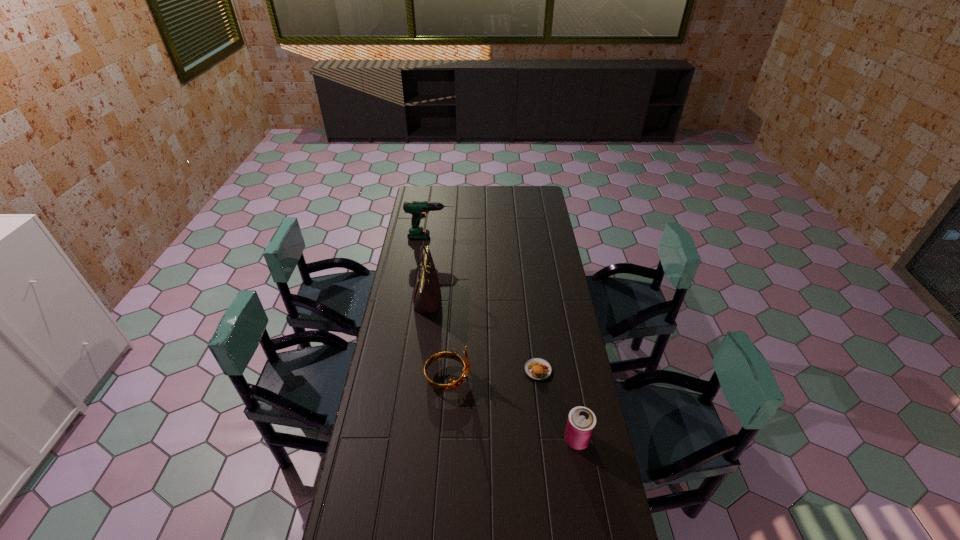
This screenshot has height=540, width=960. Find the location of `handbag`. handbag is located at coordinates (426, 295).

Identify the location of the second farthest object. Image resolution: width=960 pixels, height=540 pixels. (426, 295).

Locate an element on the screen. the farthest object is located at coordinates (418, 209).

Locate an element on the screen. the fourth shortest object is located at coordinates (418, 209).

The height and width of the screenshot is (540, 960). I want to click on the third tallest object, so click(452, 355).

Where is `the rightmost object`? The image size is (960, 540). the rightmost object is located at coordinates (581, 422).

Locate an element on the screen. The height and width of the screenshot is (540, 960). can is located at coordinates (581, 422).

I want to click on the second object from right to left, so click(x=538, y=369).

Locate an element on the screen. Image resolution: width=960 pixels, height=540 pixels. patty is located at coordinates (538, 369).

Where is `vacant space located 0.070m on the front-facing side of the fourth nearest object`? This screenshot has height=540, width=960. vacant space located 0.070m on the front-facing side of the fourth nearest object is located at coordinates (455, 299).